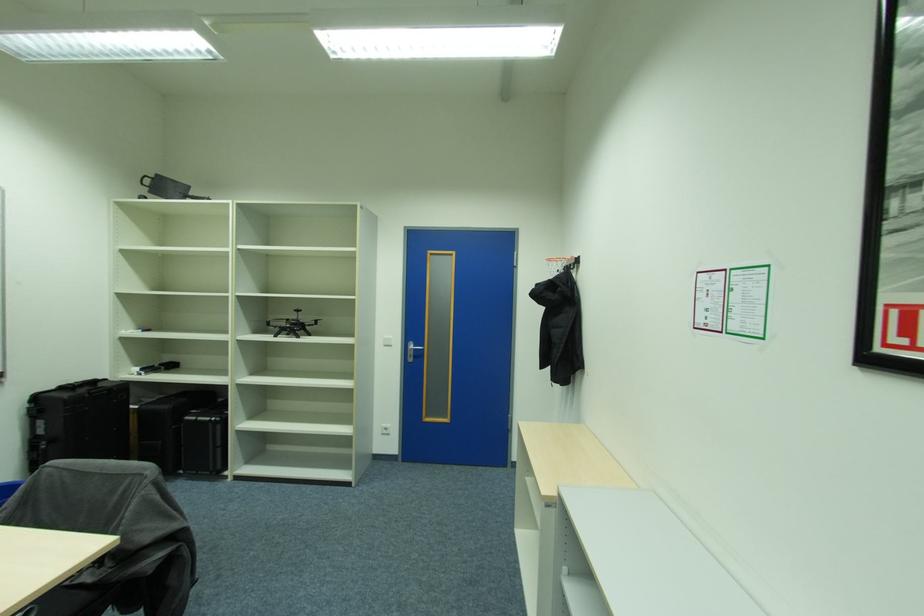
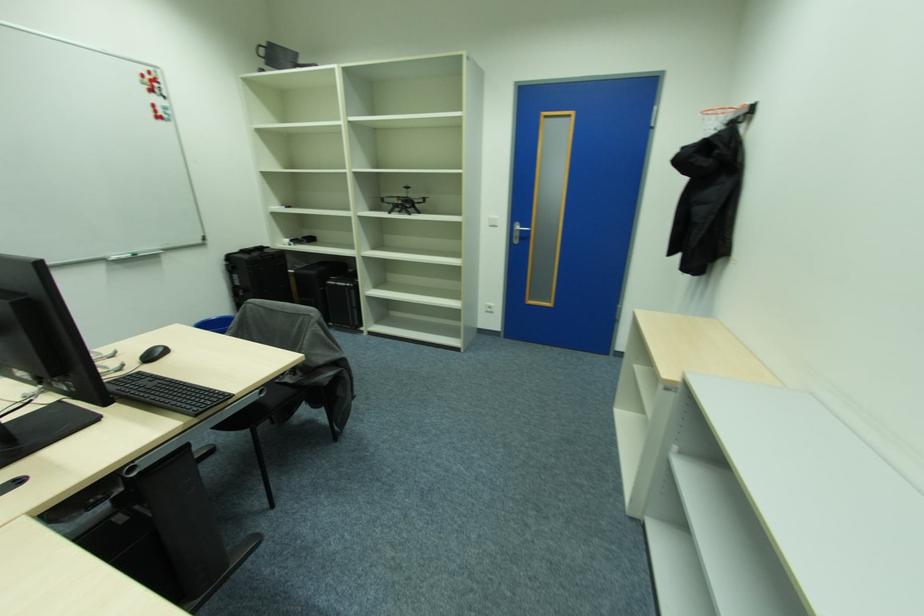
From the picture: In a continuous first-person perspective shot, in which direction is the camera moving?

The cameraman walked toward left, forward.